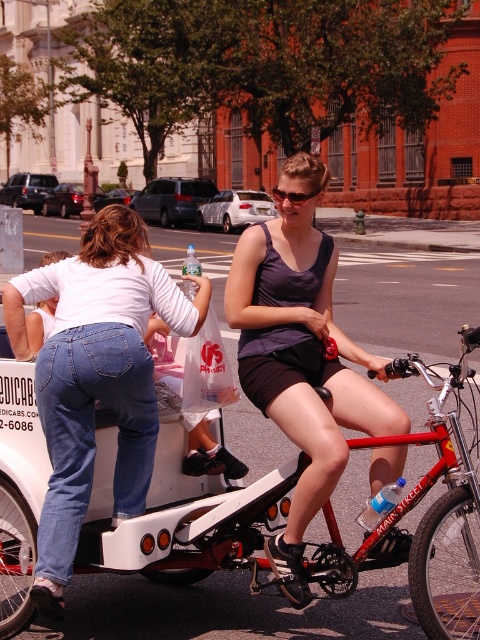
Question: Which of the following is the closest to the observer?

Choices:
 (A) [291, 316]
 (B) [172, 285]

Answer: (A)

Question: Is denim shorts at center above red matte bicycle at center?

Choices:
 (A) yes
 (B) no

Answer: (A)

Question: Does matte purple tank top at center have a greater width compared to red matte bicycle at center?

Choices:
 (A) yes
 (B) no

Answer: (B)

Question: Which object is positioned farthest from the red matte bicycle at center?

Choices:
 (A) matte purple tank top at center
 (B) denim shorts at center

Answer: (B)

Question: Is denim shorts at center to the right of matte purple tank top at center from the viewer's perspective?

Choices:
 (A) yes
 (B) no

Answer: (B)

Question: Which point appears closest to the camera in this image?

Choices:
 (A) (245, 321)
 (B) (370, 445)
 (C) (144, 387)

Answer: (B)